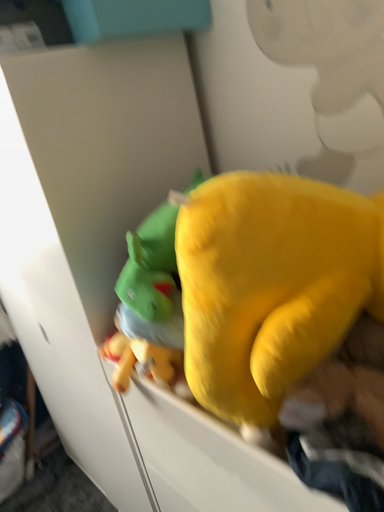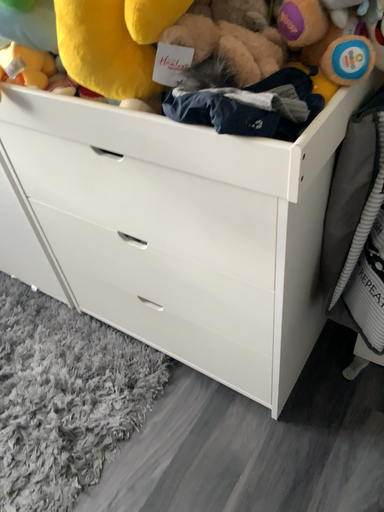
Question: How did the camera likely rotate when shooting the video?

Choices:
 (A) rotated upward
 (B) rotated downward

Answer: (B)